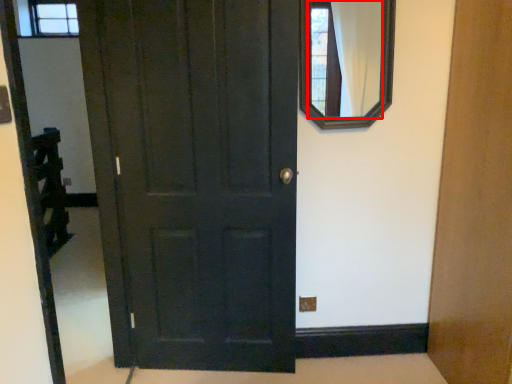
Question: Where is mirror (annotated by the red box) located in relation to door in the image?

Choices:
 (A) right
 (B) left

Answer: (A)